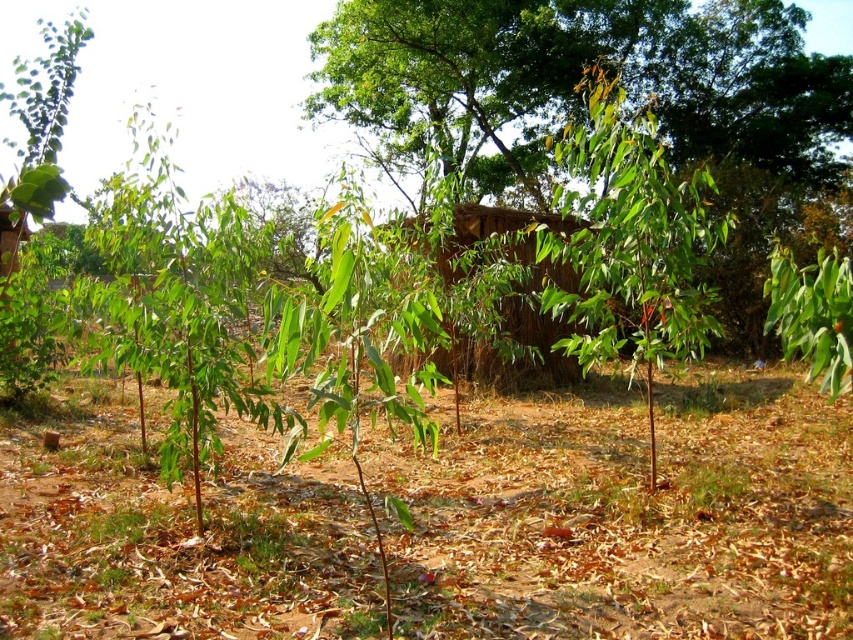
Question: Among these points, which one is nearest to the camera?

Choices:
 (A) (703, 236)
 (B) (677, 36)
 (C) (80, 515)

Answer: (C)

Question: Is green leafy plant at center smaller than brown thatch hut at center?

Choices:
 (A) yes
 (B) no

Answer: (B)

Question: Which of these objects is positioned closest to the brown thatch hut at center?

Choices:
 (A) green leafy tree at center
 (B) green leafy plant at center

Answer: (B)

Question: Does green leafy tree at center appear under brown thatch hut at center?

Choices:
 (A) yes
 (B) no

Answer: (B)

Question: Which object is positioned closest to the green leafy tree at center?

Choices:
 (A) green leafy plant at center
 (B) brown thatch hut at center

Answer: (A)

Question: Can you confirm if green leafy plant at center is positioned above brown thatch hut at center?

Choices:
 (A) yes
 (B) no

Answer: (A)